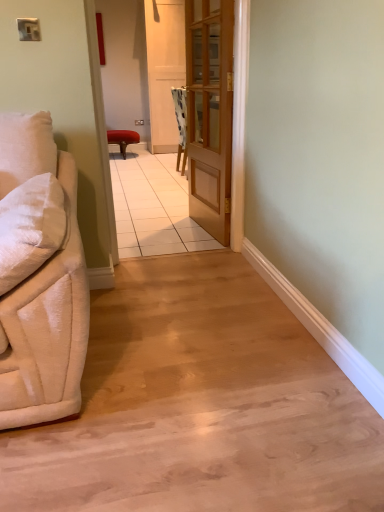
At what (x,y) coordinates should I click in order to perform the action: click on unoccupied area in front of wooden door at center. Please return your answer as a coordinate pair (x, y). This screenshot has height=512, width=384. Looking at the image, I should click on (154, 275).